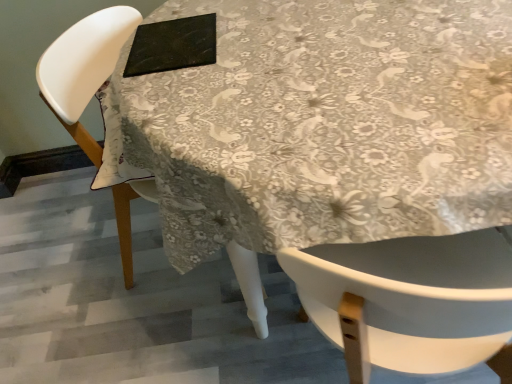
Identify the location of vacant space in front of black matte pad at upper center. (177, 77).